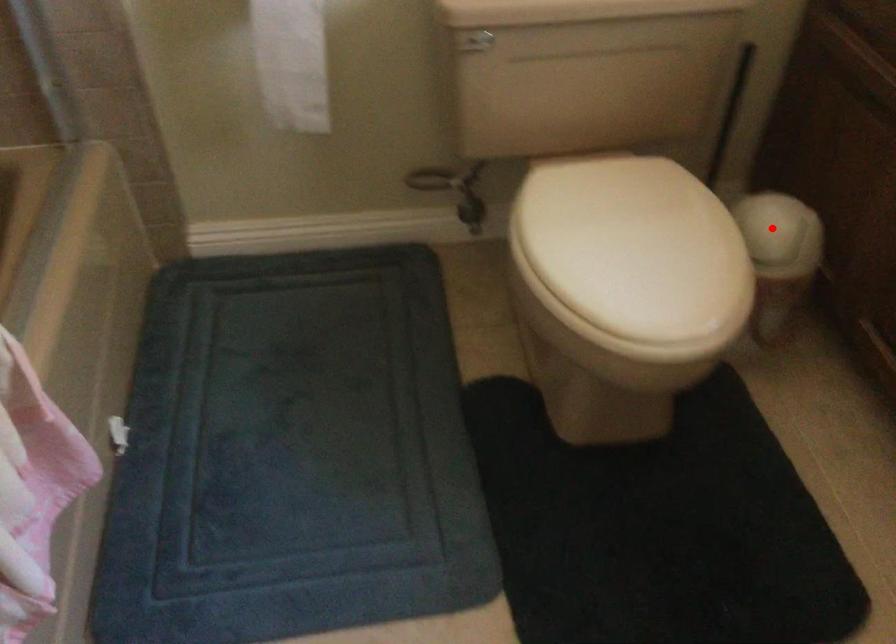
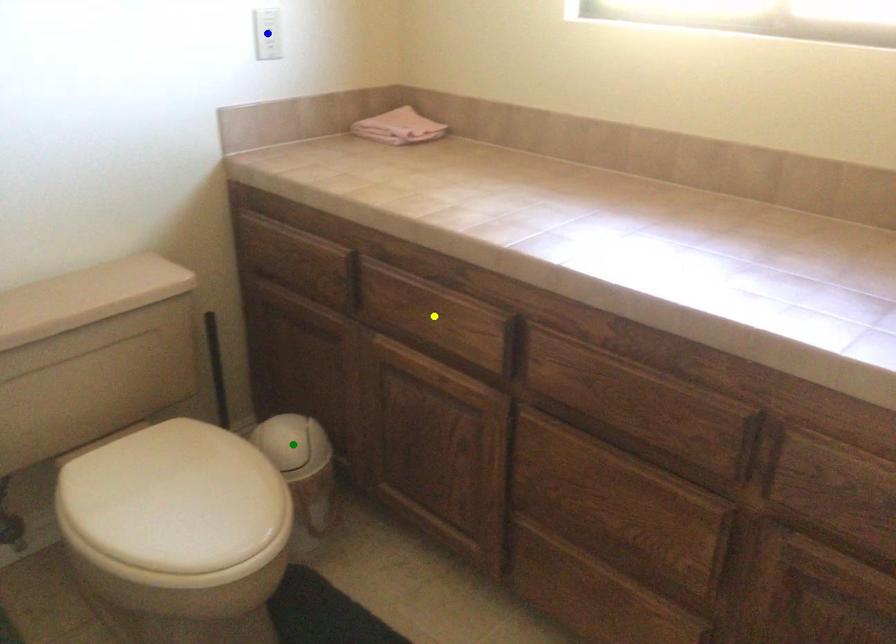
Question: I am providing you with two images of the same scene from different viewpoints. A red point is marked on the first image. You are given multiple points on the second image. In image 2, which mark is for the same physical point as the one in image 1?

Choices:
 (A) blue point
 (B) yellow point
 (C) green point

Answer: (C)